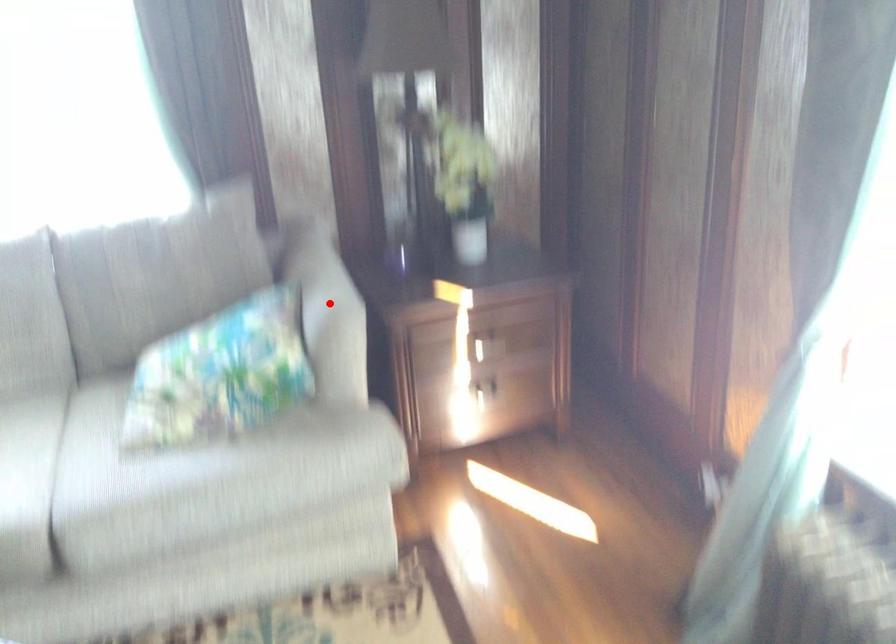
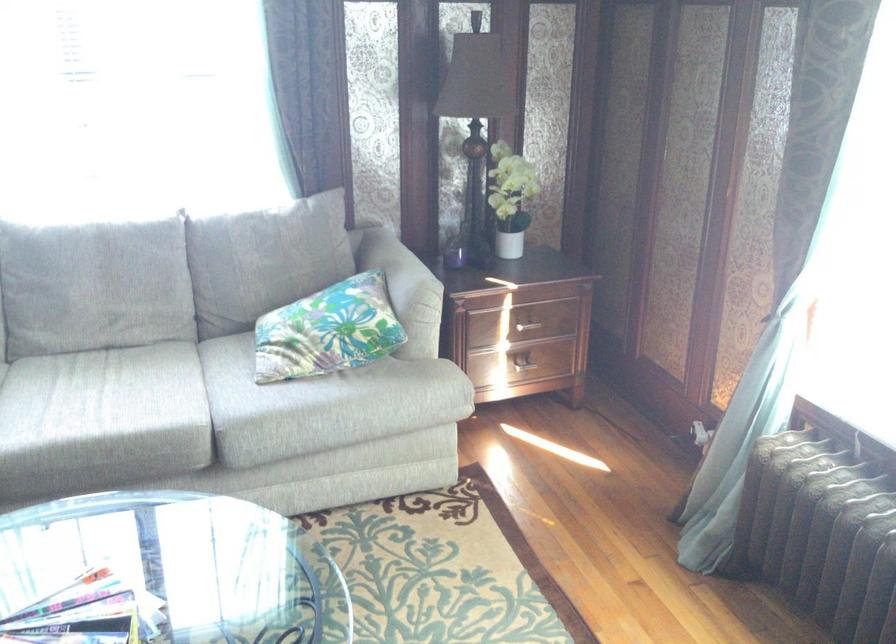
The point at the highlighted location is marked in the first image. Where is the corresponding point in the second image?

(409, 279)